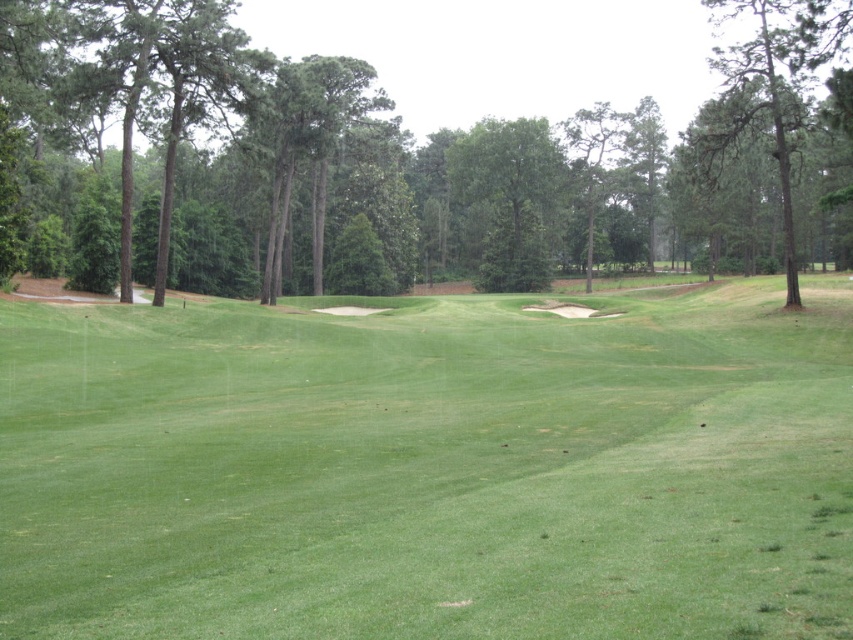
Does green grassy fairway at center appear on the left side of green leafy tree at center?

Yes, green grassy fairway at center is to the left of green leafy tree at center.

Between green grassy fairway at center and green leafy tree at center, which one is positioned lower?

green grassy fairway at center is lower down.

Locate an element on the screen. This screenshot has height=640, width=853. green grassy fairway at center is located at coordinates (428, 467).

This screenshot has width=853, height=640. What do you see at coordinates (428, 467) in the screenshot?
I see `green grassy fairway at center` at bounding box center [428, 467].

You are a GUI agent. You are given a task and a screenshot of the screen. Output one action in this format:
    pyautogui.click(x=<x>, y=<y>)
    Task: Click on the green grassy fairway at center
    The width and height of the screenshot is (853, 640).
    Given the screenshot: What is the action you would take?
    pyautogui.click(x=428, y=467)

Where is `green grassy fairway at center`? green grassy fairway at center is located at coordinates (428, 467).

Does green leafy tree at center have a greater height compared to green textured pine tree at upper right?

Indeed, green leafy tree at center has a greater height compared to green textured pine tree at upper right.

Does green leafy tree at center have a larger size compared to green textured pine tree at upper right?

Yes.

The image size is (853, 640). What do you see at coordinates (412, 157) in the screenshot?
I see `green leafy tree at center` at bounding box center [412, 157].

Where is `green leafy tree at center`? green leafy tree at center is located at coordinates (412, 157).